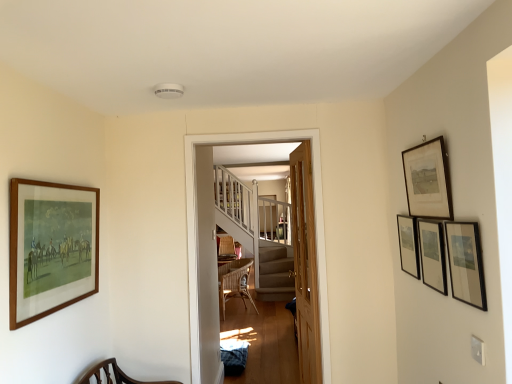
Where is `free spot above wooden staircase at center (from a real-world perspective)`? The image size is (512, 384). free spot above wooden staircase at center (from a real-world perspective) is located at coordinates (256, 129).